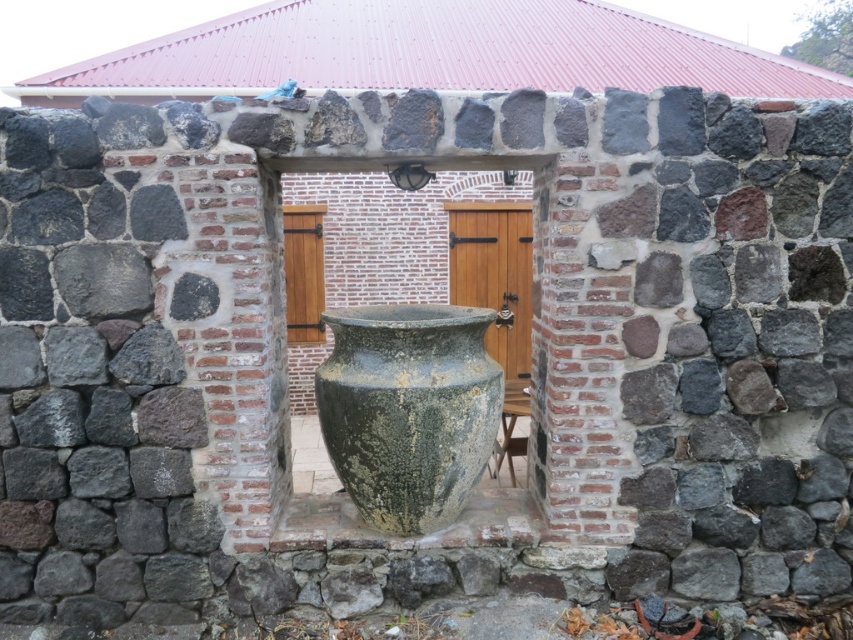
Can you confirm if green mossy stone vase at center is shorter than wooden stool at center?

Incorrect, green mossy stone vase at center's height does not fall short of wooden stool at center's.

Measure the distance between point (395, 513) and camera.

3.70 meters

Between point (375, 353) and point (514, 477), which one is positioned in front?

Point (375, 353)

Image resolution: width=853 pixels, height=640 pixels. Identify the location of green mossy stone vase at center. (408, 410).